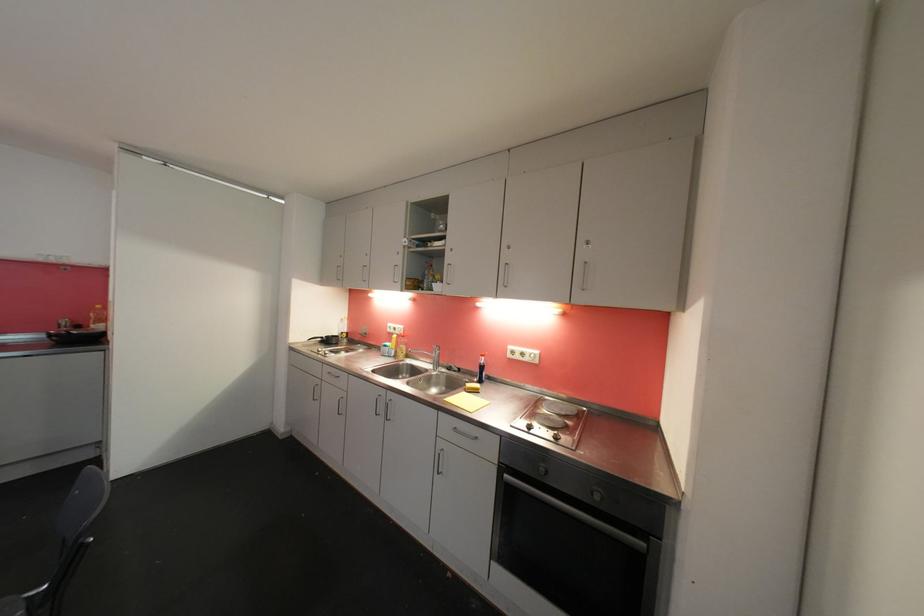
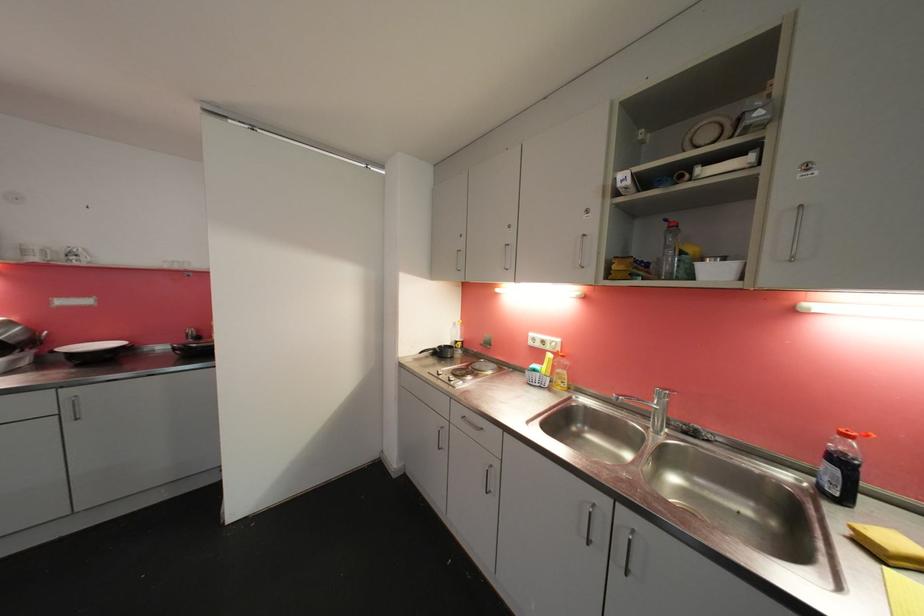
Where in the second image is the point corresponding to point (391, 349) from the first image?

(540, 373)